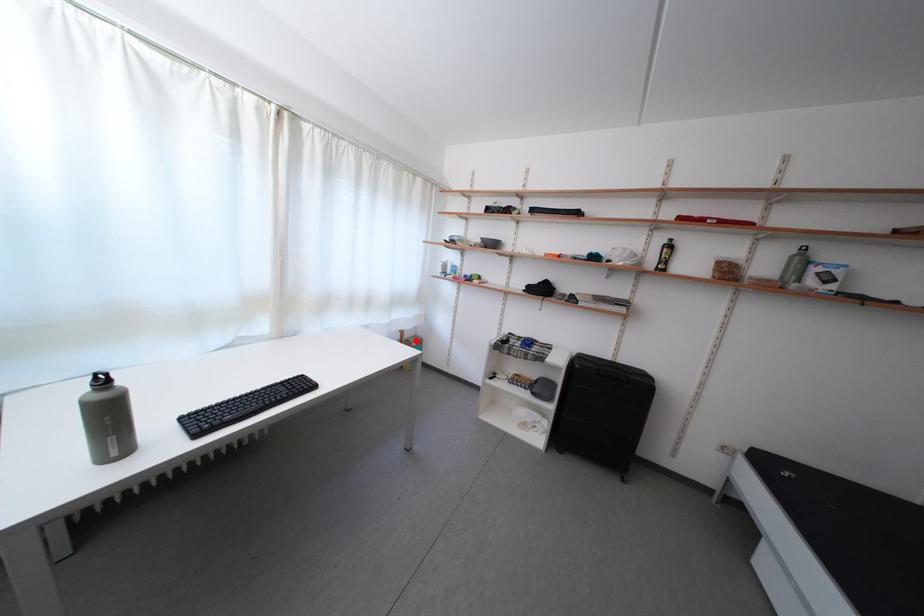
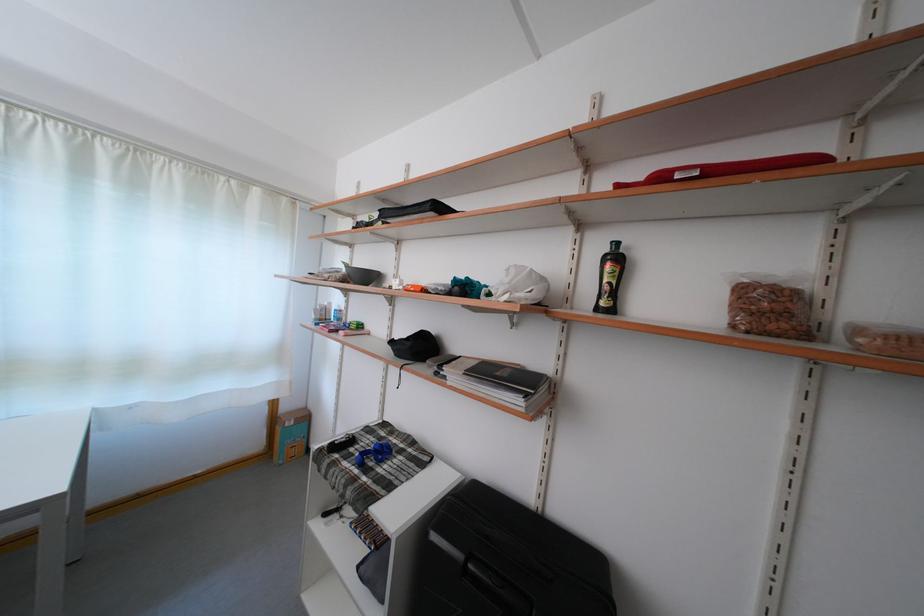
Question: I am providing you with two images of the same scene from different viewpoints. A red point is marked on the first image. At the location where the point appears in image 1, is it still visible in image 2?

Choices:
 (A) Yes
 (B) No

Answer: (A)